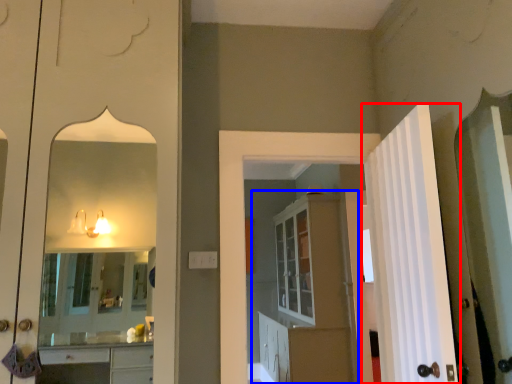
Question: Which object appears farthest to the camera in this image, door (highlighted by a red box) or dresser (highlighted by a blue box)?

Choices:
 (A) door
 (B) dresser

Answer: (B)